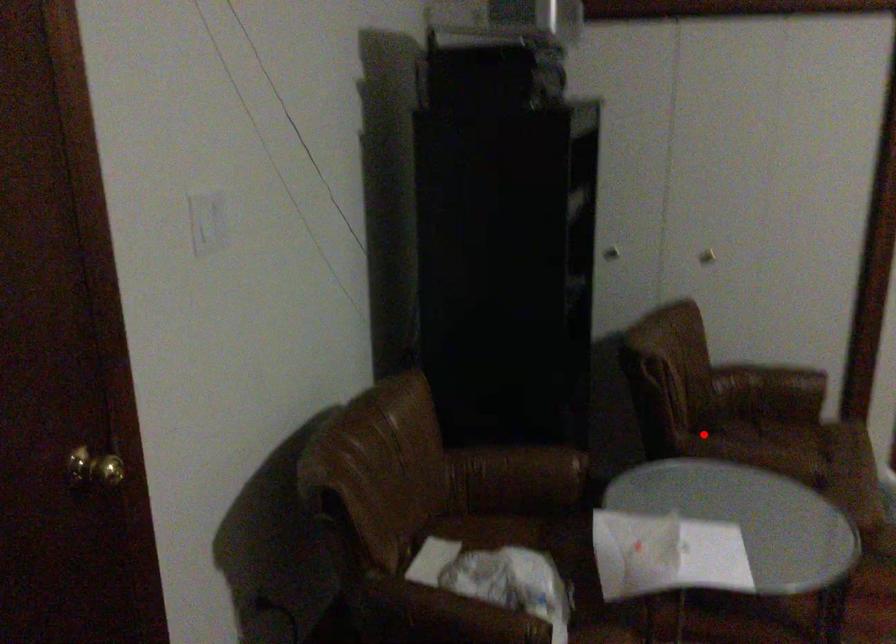
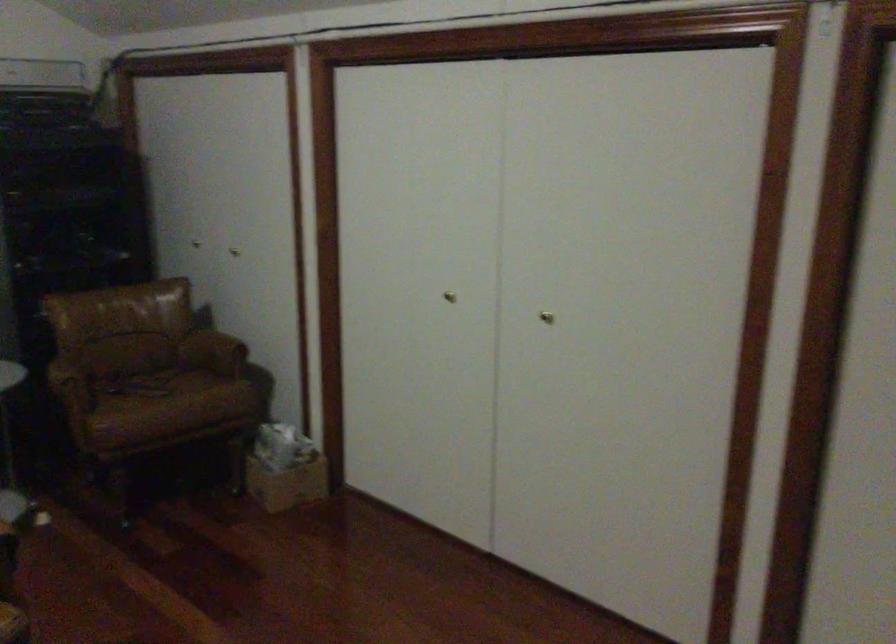
In the second image, find the point that corresponds to the highlighted location in the first image.

(149, 370)